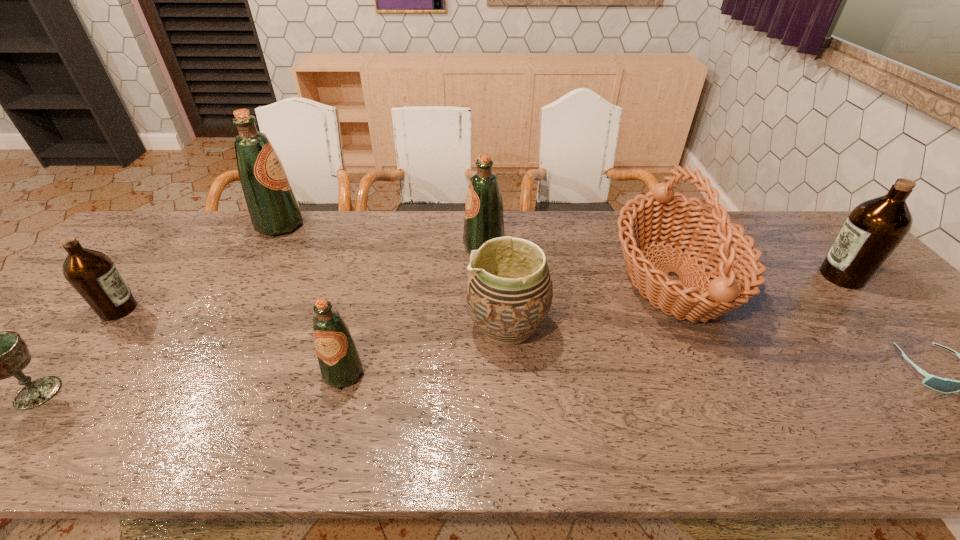
Where is `free spot between the pottery and the tallest object`? free spot between the pottery and the tallest object is located at coordinates (394, 276).

I want to click on empty space between the fourth farthest olive oil and the fourth olive oil from left to right, so click(x=301, y=278).

The image size is (960, 540). In order to click on empty space between the left brown olive oil and the pottery in this screenshot , I will do `click(313, 318)`.

The image size is (960, 540). I want to click on object identified as the sixth closest to the pottery, so click(873, 230).

The image size is (960, 540). What are the coordinates of `the fifth closest object to the brown basket` in the screenshot? It's located at (339, 360).

Identify which olive oil is the fourth closest to the farther brown olive oil. Please provide its 2D coordinates. Your answer should be formatted as a tuple, i.e. [(x, y)], where the tuple contains the x and y coordinates of a point satisfying the conditions above.

[(91, 273)]

Find the location of `the third closest olive oil to the chalice`. the third closest olive oil to the chalice is located at coordinates (339, 360).

At what (x,y) coordinates should I click in order to perform the action: click on green olive oil that stands as the closest to the rightmost olive oil. Please return your answer as a coordinate pair (x, y). Looking at the image, I should click on pos(484,221).

Identify the location of the closest green olive oil to the third object from right to left. (484, 221).

The image size is (960, 540). Find the location of `free region that satisfies the following two spatial constraints: 1. on the label of the smaller brown olive oil; 2. on the back side of the brown pottery`. free region that satisfies the following two spatial constraints: 1. on the label of the smaller brown olive oil; 2. on the back side of the brown pottery is located at coordinates (104, 326).